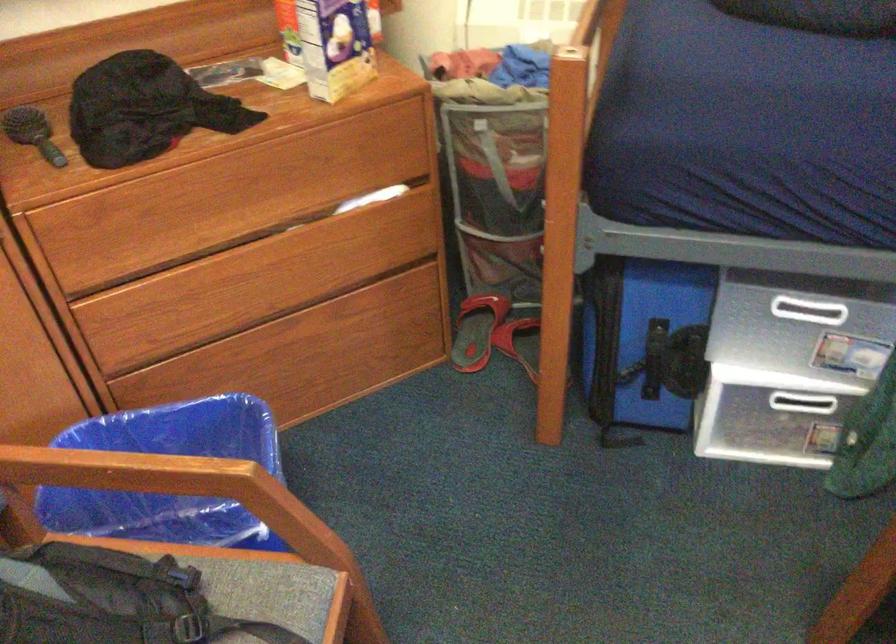
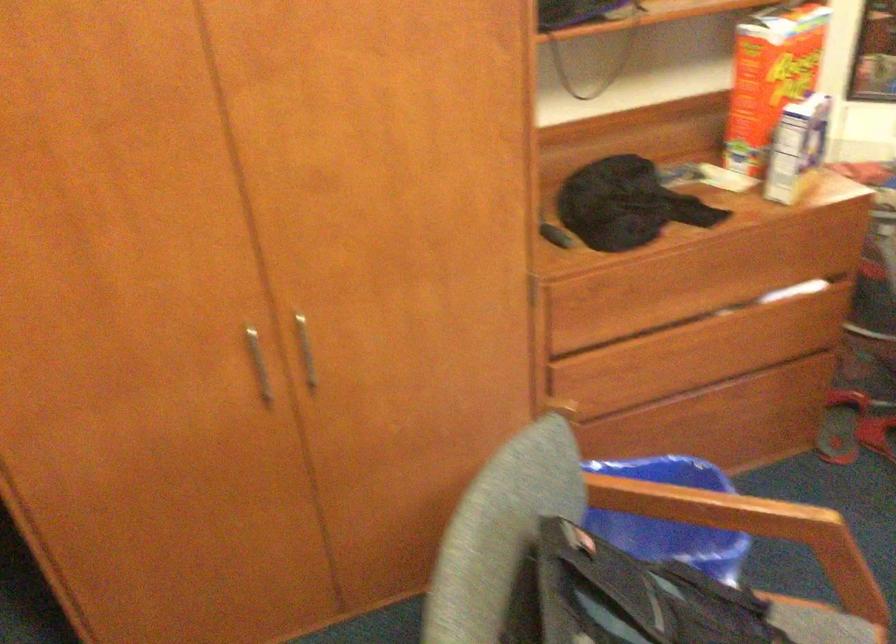
In a continuous first-person perspective shot, in which direction is the camera moving?

The cameraman moved toward left, backward.